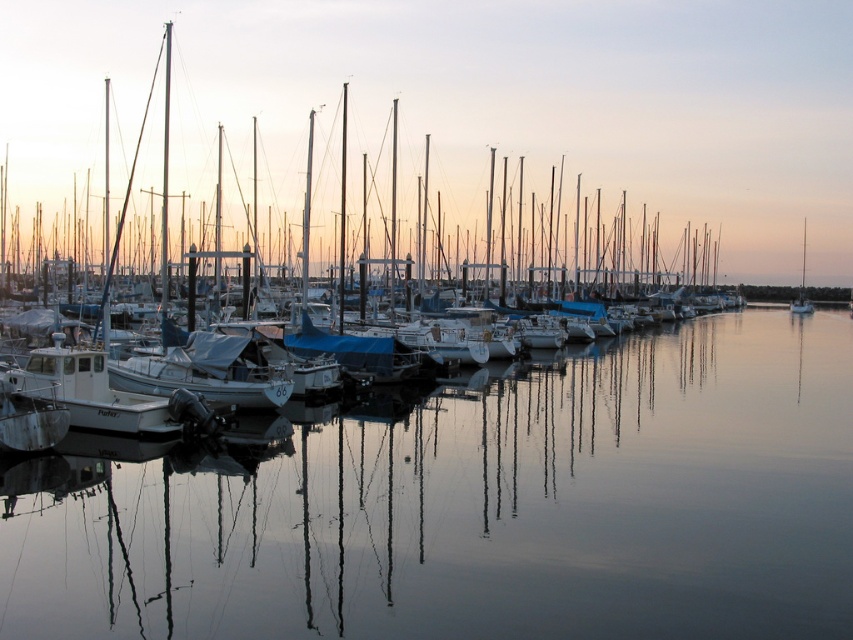
Question: Among these objects, which one is farthest from the camera?

Choices:
 (A) clear water at center
 (B) white sailboat at right
 (C) white matte boat at left

Answer: (B)

Question: Is clear water at center positioned before white matte boat at left?

Choices:
 (A) no
 (B) yes

Answer: (B)

Question: Which point is closer to the camera?

Choices:
 (A) tap(734, 168)
 (B) tap(810, 477)

Answer: (B)

Question: Can you confirm if white matte boat at left is bigger than white sailboat at right?

Choices:
 (A) yes
 (B) no

Answer: (A)

Question: Does white matte boat at left lie behind white sailboat at right?

Choices:
 (A) yes
 (B) no

Answer: (B)

Question: Among these objects, which one is nearest to the camera?

Choices:
 (A) white matte boat at left
 (B) clear water at center

Answer: (B)